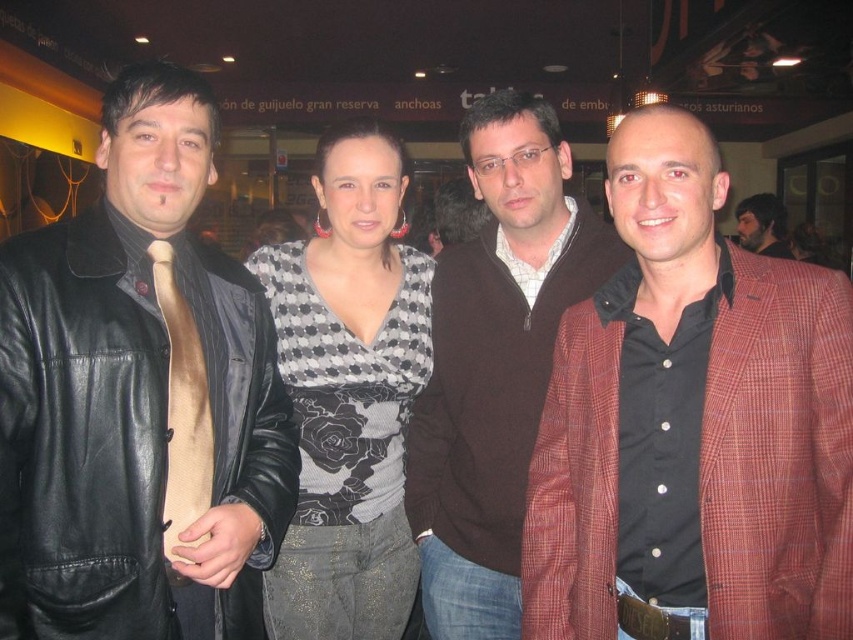
Who is higher up, black leather jacket at left or brown zip-up sweater at center?

brown zip-up sweater at center

Is black leather jacket at left bigger than brown zip-up sweater at center?

No, black leather jacket at left is not bigger than brown zip-up sweater at center.

What do you see at coordinates (83, 435) in the screenshot?
I see `black leather jacket at left` at bounding box center [83, 435].

In order to click on black leather jacket at left in this screenshot , I will do `click(83, 435)`.

Does brown zip-up sweater at center have a greater height compared to brown leather jacket at center?

Indeed, brown zip-up sweater at center has a greater height compared to brown leather jacket at center.

Does point (485, 636) come behind point (770, 202)?

No, it is in front of (770, 202).

Locate an element on the screen. This screenshot has height=640, width=853. brown zip-up sweater at center is located at coordinates (495, 362).

Can you confirm if black leather jacket at left is positioned below beige silk tie at left?

Yes.

Who is positioned more to the right, black leather jacket at left or beige silk tie at left?

beige silk tie at left

This screenshot has width=853, height=640. What do you see at coordinates (83, 435) in the screenshot?
I see `black leather jacket at left` at bounding box center [83, 435].

You are a GUI agent. You are given a task and a screenshot of the screen. Output one action in this format:
    pyautogui.click(x=<x>, y=<y>)
    Task: Click on the black leather jacket at left
    
    Given the screenshot: What is the action you would take?
    pyautogui.click(x=83, y=435)